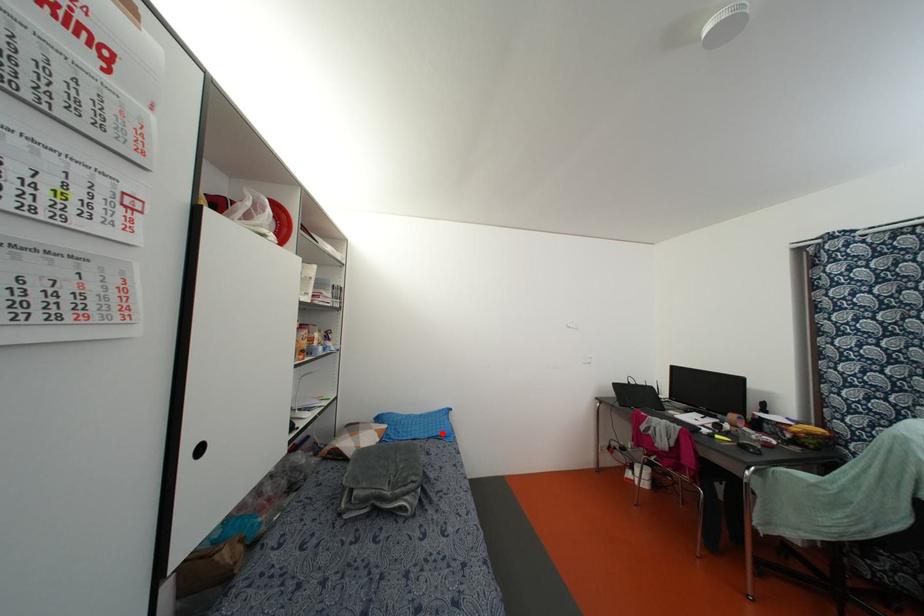
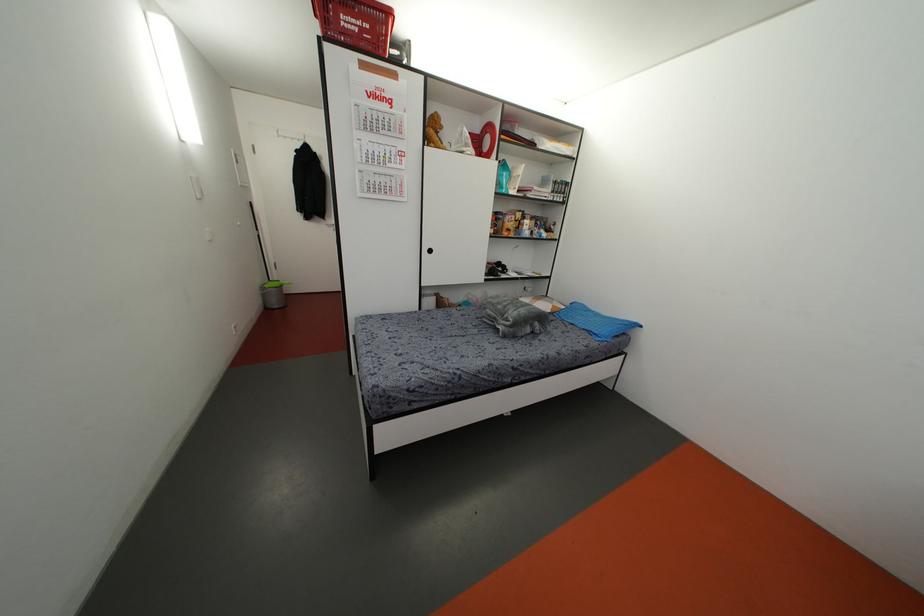
In the second image, find the point that corresponds to the highlighted location in the first image.

(596, 331)